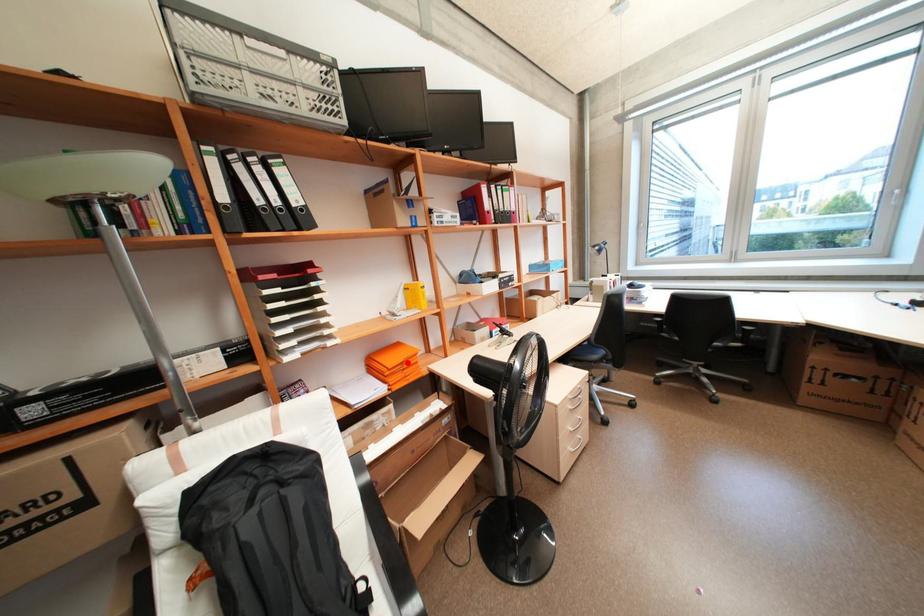
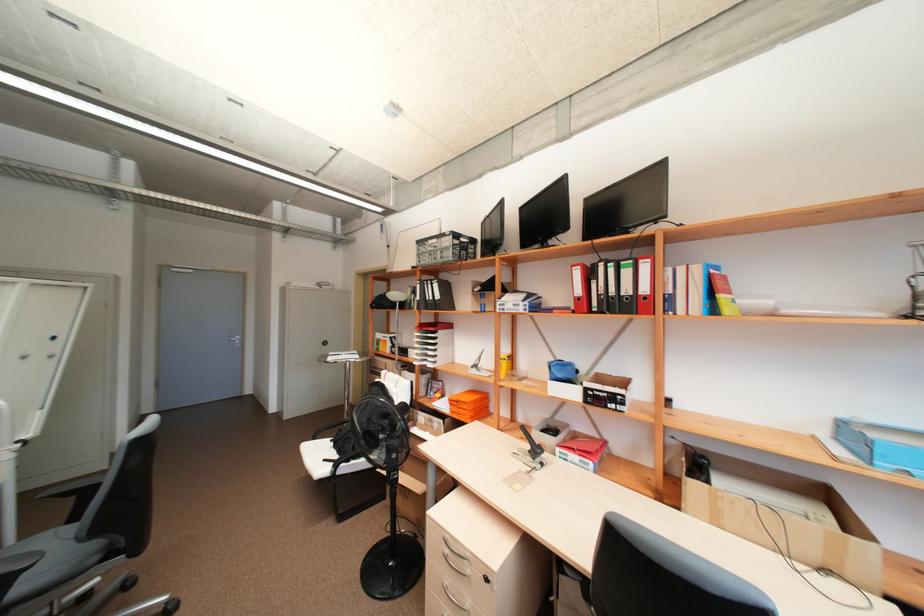
The point at the highlighted location is marked in the first image. Where is the corresponding point in the second image?

(463, 400)